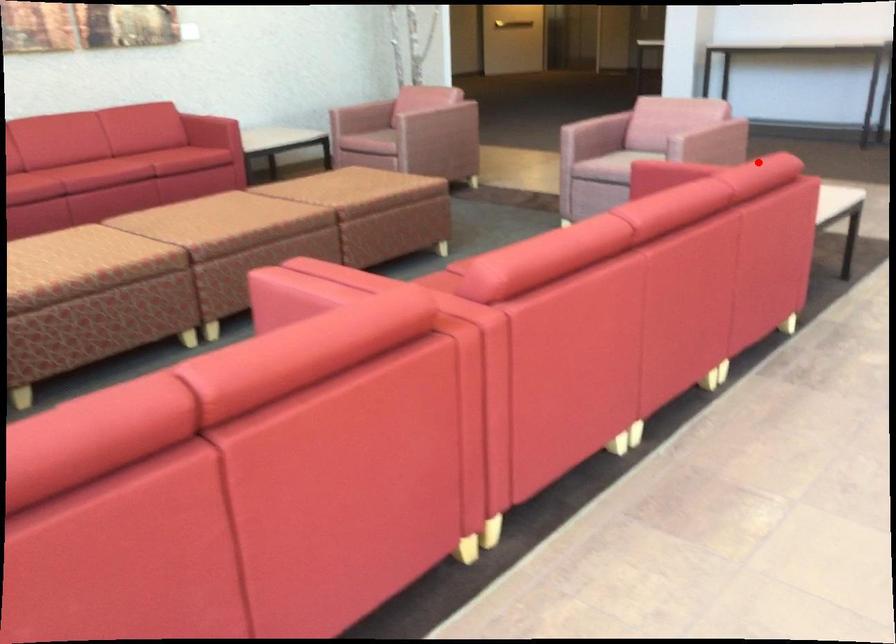
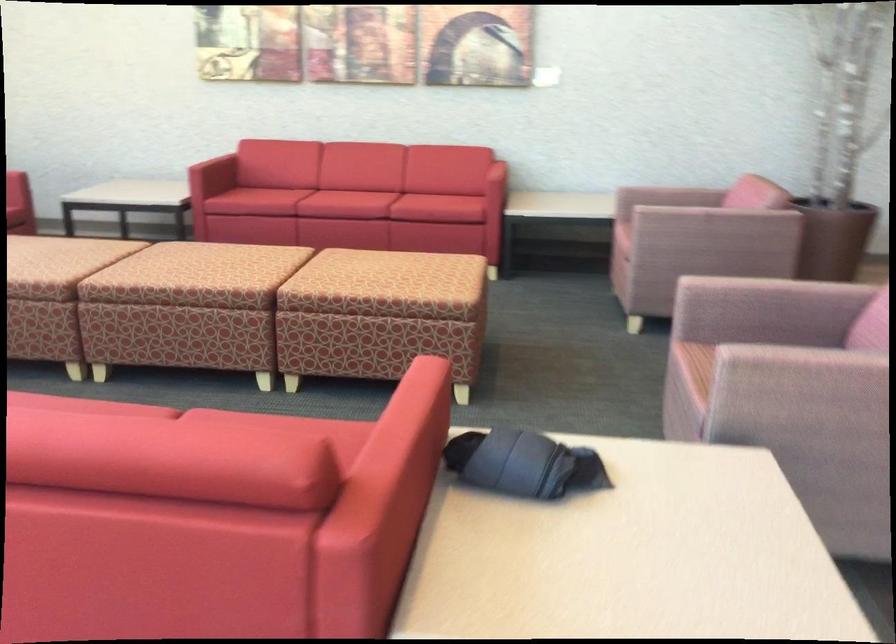
Find the pixel in the second image that matches the highlighted location in the first image.

(173, 442)